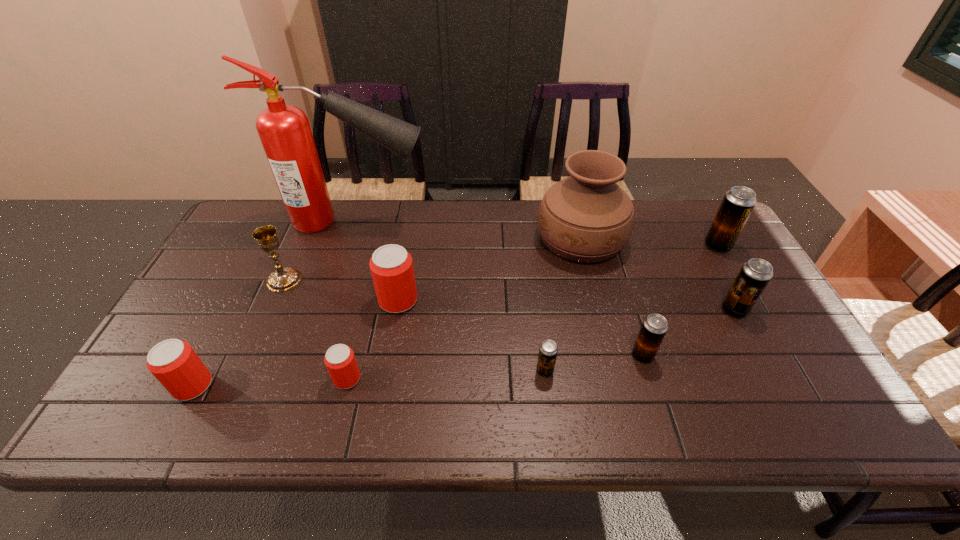
Where is `the second smallest red beer can`? The height and width of the screenshot is (540, 960). the second smallest red beer can is located at coordinates tap(173, 362).

In order to click on the fifth beer can from left to right in this screenshot , I will do `click(654, 327)`.

The height and width of the screenshot is (540, 960). Identify the location of the third biggest black beer can. (654, 327).

Where is `the smallest red beer can`? The width and height of the screenshot is (960, 540). the smallest red beer can is located at coordinates (339, 359).

What are the coordinates of `the second red beer can from left to right` in the screenshot? It's located at (339, 359).

Identify the location of the smallest black beer can. (548, 350).

The image size is (960, 540). In order to click on the fourth beer can from right to left in this screenshot , I will do `click(548, 350)`.

Image resolution: width=960 pixels, height=540 pixels. Identify the location of vacant space located 0.170m at the nozzle of the red fire extinguisher. (481, 221).

The height and width of the screenshot is (540, 960). What are the coordinates of `free space located on the front of the urn` in the screenshot? It's located at (610, 356).

Identify the location of free space located on the left of the tallest beer can. Image resolution: width=960 pixels, height=540 pixels. (624, 246).